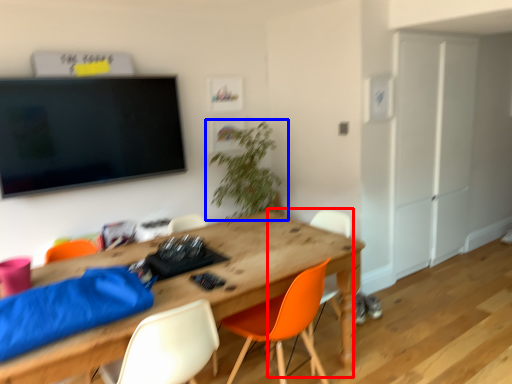
Question: Which object is closer to the camera taking this photo, chair (highlighted by a red box) or houseplant (highlighted by a blue box)?

Choices:
 (A) chair
 (B) houseplant

Answer: (A)